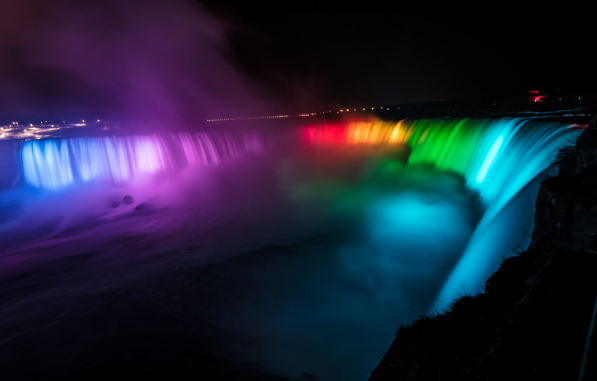
Identify the location of blue lights. (29, 159), (56, 164).